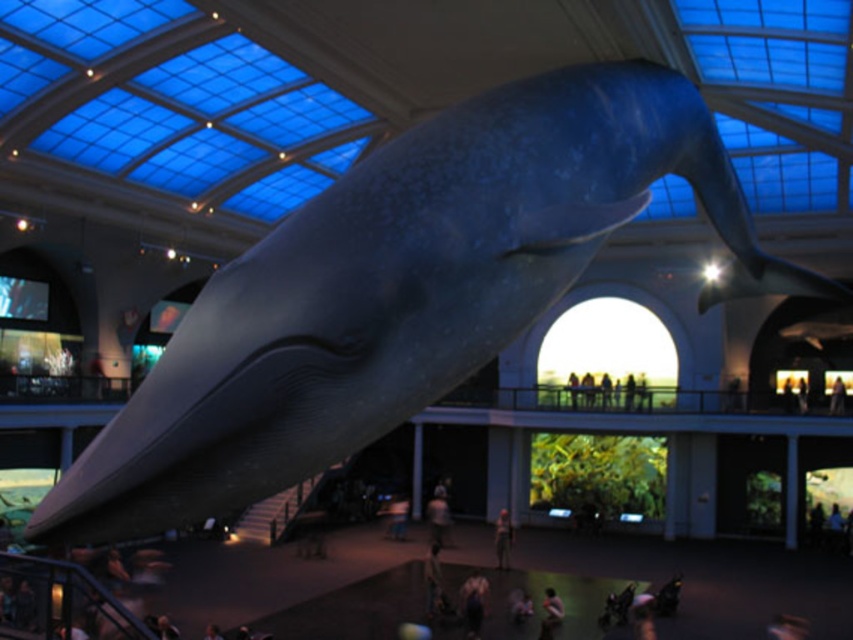
You are a visitor in the museum and want to take a photo of the blue whale model. You are standing at the location of the smooth skin person at lower center. Can you fit the entire dark gray fabric pants at center into your photo without moving? Explain your reasoning.

The dark gray fabric pants at center is 5.69 meters away from the smooth skin person at lower center. Since the distance is quite large, it is likely that the entire dark gray fabric pants at center can be captured in the photo without needing to move, as most cameras have wide enough lenses to accommodate such a distance.

You are standing in a museum and see the dark gray fabric pants at center displayed in the hall. If you want to take a photo of the pants from where you are standing, will you need a zoom lens to capture them clearly?

The dark gray fabric pants at center are 20.87 meters away from the viewer. Since they are quite far away, you would need a zoom lens to capture them clearly.